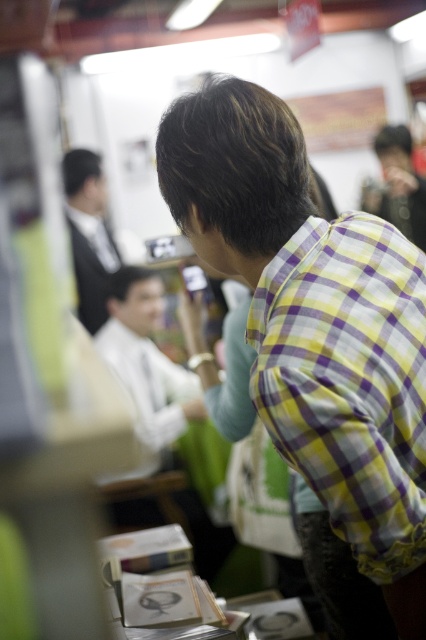
You are a photographer who wants to ensure that both the white shirt at center and the formal black suit at upper left are clearly visible in your photo. Given their current positions and sizes, which one might require you to adjust your camera angle to avoid being too small in the frame?

The white shirt at center is not as tall as formal black suit at upper left, so the white shirt at center might require adjusting the camera angle to ensure it isn